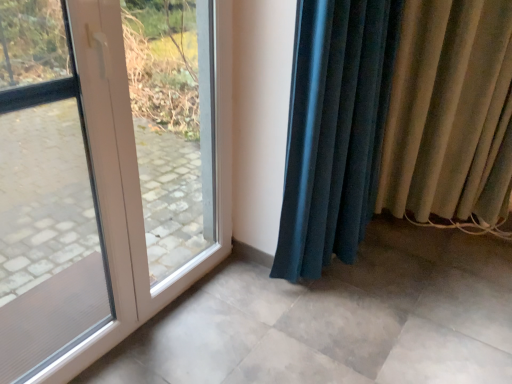
What do you see at coordinates (450, 113) in the screenshot?
I see `beige fabric curtain at right, positioned as the 1th curtain in right-to-left order` at bounding box center [450, 113].

What do you see at coordinates (106, 172) in the screenshot? I see `white plastic door at left` at bounding box center [106, 172].

Image resolution: width=512 pixels, height=384 pixels. I want to click on beige fabric curtain at right, positioned as the 1th curtain in right-to-left order, so click(450, 113).

Does velvet teal curtain at lower right, placed as the second curtain when sorted from right to left, have a smaller size compared to white plastic door at left?

Actually, velvet teal curtain at lower right, placed as the second curtain when sorted from right to left, might be larger than white plastic door at left.

In the scene shown: Between velvet teal curtain at lower right, placed as the second curtain when sorted from right to left, and white plastic door at left, which one has larger width?

With larger width is velvet teal curtain at lower right, placed as the second curtain when sorted from right to left.

Considering the relative sizes of velvet teal curtain at lower right, placed as the second curtain when sorted from right to left, and white plastic door at left in the image provided, is velvet teal curtain at lower right, placed as the second curtain when sorted from right to left, shorter than white plastic door at left?

No.

Does velvet teal curtain at lower right, acting as the first curtain starting from the left, appear on the right side of white plastic door at left?

Correct, you'll find velvet teal curtain at lower right, acting as the first curtain starting from the left, to the right of white plastic door at left.

Could you tell me if white plastic door at left is turned towards velvet teal curtain at lower right, acting as the first curtain starting from the left?

No, white plastic door at left does not turn towards velvet teal curtain at lower right, acting as the first curtain starting from the left.

Is point (50, 323) closer to camera compared to point (345, 174)?

Yes, point (50, 323) is closer to viewer.

At what (x,y) coordinates should I click in order to perform the action: click on door on the left of velvet teal curtain at lower right, acting as the first curtain starting from the left. Please return your answer as a coordinate pair (x, y). The image size is (512, 384). Looking at the image, I should click on (106, 172).

In the scene shown: Are white plastic door at left and velvet teal curtain at lower right, placed as the second curtain when sorted from right to left, located far from each other?

That's right, there is a large distance between white plastic door at left and velvet teal curtain at lower right, placed as the second curtain when sorted from right to left.

Measure the distance between beige fabric curtain at right, arranged as the second curtain when viewed from the left, and white plastic door at left.

1.30 meters.

Is beige fabric curtain at right, positioned as the 1th curtain in right-to-left order, placed right next to white plastic door at left?

No, beige fabric curtain at right, positioned as the 1th curtain in right-to-left order, is not beside white plastic door at left.

Relative to white plastic door at left, is beige fabric curtain at right, positioned as the 1th curtain in right-to-left order, in front or behind?

In the image, beige fabric curtain at right, positioned as the 1th curtain in right-to-left order, appears behind white plastic door at left.

Is beige fabric curtain at right, positioned as the 1th curtain in right-to-left order, at the right side of white plastic door at left?

Indeed, beige fabric curtain at right, positioned as the 1th curtain in right-to-left order, is positioned on the right side of white plastic door at left.

Which is closer, [444,184] or [476,77]?

Point [444,184].

Is beige fabric curtain at right, arranged as the second curtain when viewed from the left, facing towards velvet teal curtain at lower right, acting as the first curtain starting from the left?

No, beige fabric curtain at right, arranged as the second curtain when viewed from the left, is not oriented towards velvet teal curtain at lower right, acting as the first curtain starting from the left.

Consider the image. Can you tell me how much beige fabric curtain at right, positioned as the 1th curtain in right-to-left order, and velvet teal curtain at lower right, acting as the first curtain starting from the left, differ in facing direction?

The angle between the facing direction of beige fabric curtain at right, positioned as the 1th curtain in right-to-left order, and the facing direction of velvet teal curtain at lower right, acting as the first curtain starting from the left, is 57 degrees.

Considering the relative sizes of beige fabric curtain at right, positioned as the 1th curtain in right-to-left order, and velvet teal curtain at lower right, acting as the first curtain starting from the left, in the image provided, is beige fabric curtain at right, positioned as the 1th curtain in right-to-left order, bigger than velvet teal curtain at lower right, acting as the first curtain starting from the left,?

Actually, beige fabric curtain at right, positioned as the 1th curtain in right-to-left order, might be smaller than velvet teal curtain at lower right, acting as the first curtain starting from the left.

Based on their sizes in the image, would you say velvet teal curtain at lower right, placed as the second curtain when sorted from right to left, is bigger or smaller than beige fabric curtain at right, arranged as the second curtain when viewed from the left?

Clearly, velvet teal curtain at lower right, placed as the second curtain when sorted from right to left, is larger in size than beige fabric curtain at right, arranged as the second curtain when viewed from the left.

Which is behind, point (455, 85) or point (481, 185)?

Point (481, 185)

Between velvet teal curtain at lower right, acting as the first curtain starting from the left, and beige fabric curtain at right, arranged as the second curtain when viewed from the left, which one has more height?

velvet teal curtain at lower right, acting as the first curtain starting from the left, is taller.

From a real-world perspective, is white plastic door at left physically located above or below beige fabric curtain at right, arranged as the second curtain when viewed from the left?

In terms of real-world spatial position, white plastic door at left is below beige fabric curtain at right, arranged as the second curtain when viewed from the left.

Is white plastic door at left in front of or behind beige fabric curtain at right, positioned as the 1th curtain in right-to-left order, in the image?

white plastic door at left is in front of beige fabric curtain at right, positioned as the 1th curtain in right-to-left order.

Which is more to the right, white plastic door at left or beige fabric curtain at right, arranged as the second curtain when viewed from the left?

beige fabric curtain at right, arranged as the second curtain when viewed from the left, is more to the right.

Is white plastic door at left surrounding beige fabric curtain at right, arranged as the second curtain when viewed from the left?

No, white plastic door at left does not contain beige fabric curtain at right, arranged as the second curtain when viewed from the left.

The image size is (512, 384). In order to click on curtain that is the 1st one when counting upward from the white plastic door at left (from the image's perspective) in this screenshot , I will do `click(394, 122)`.

Which curtain is the 1st one when counting from the back of the white plastic door at left? Please provide its 2D coordinates.

[(394, 122)]

When comparing their distances from beige fabric curtain at right, positioned as the 1th curtain in right-to-left order, does velvet teal curtain at lower right, placed as the second curtain when sorted from right to left, or white plastic door at left seem closer?

velvet teal curtain at lower right, placed as the second curtain when sorted from right to left, is closer to beige fabric curtain at right, positioned as the 1th curtain in right-to-left order.

Estimate the real-world distances between objects in this image. Which object is closer to white plastic door at left, velvet teal curtain at lower right, placed as the second curtain when sorted from right to left, or beige fabric curtain at right, arranged as the second curtain when viewed from the left?

Among the two, beige fabric curtain at right, arranged as the second curtain when viewed from the left, is located nearer to white plastic door at left.

Based on the photo, from the image, which object appears to be farther from velvet teal curtain at lower right, placed as the second curtain when sorted from right to left, white plastic door at left or beige fabric curtain at right, arranged as the second curtain when viewed from the left?

white plastic door at left.

Considering their positions, is white plastic door at left positioned closer to beige fabric curtain at right, arranged as the second curtain when viewed from the left, than velvet teal curtain at lower right, placed as the second curtain when sorted from right to left?

The object closer to beige fabric curtain at right, arranged as the second curtain when viewed from the left, is velvet teal curtain at lower right, placed as the second curtain when sorted from right to left.

In the scene shown: When comparing their distances from white plastic door at left, does beige fabric curtain at right, positioned as the 1th curtain in right-to-left order, or velvet teal curtain at lower right, placed as the second curtain when sorted from right to left, seem further?

The object further to white plastic door at left is velvet teal curtain at lower right, placed as the second curtain when sorted from right to left.

When comparing their distances from velvet teal curtain at lower right, placed as the second curtain when sorted from right to left, does beige fabric curtain at right, arranged as the second curtain when viewed from the left, or white plastic door at left seem closer?

Based on the image, beige fabric curtain at right, arranged as the second curtain when viewed from the left, appears to be nearer to velvet teal curtain at lower right, placed as the second curtain when sorted from right to left.

Find the location of a particular element. curtain between white plastic door at left and beige fabric curtain at right, positioned as the 1th curtain in right-to-left order, in the horizontal direction is located at coordinates (394, 122).